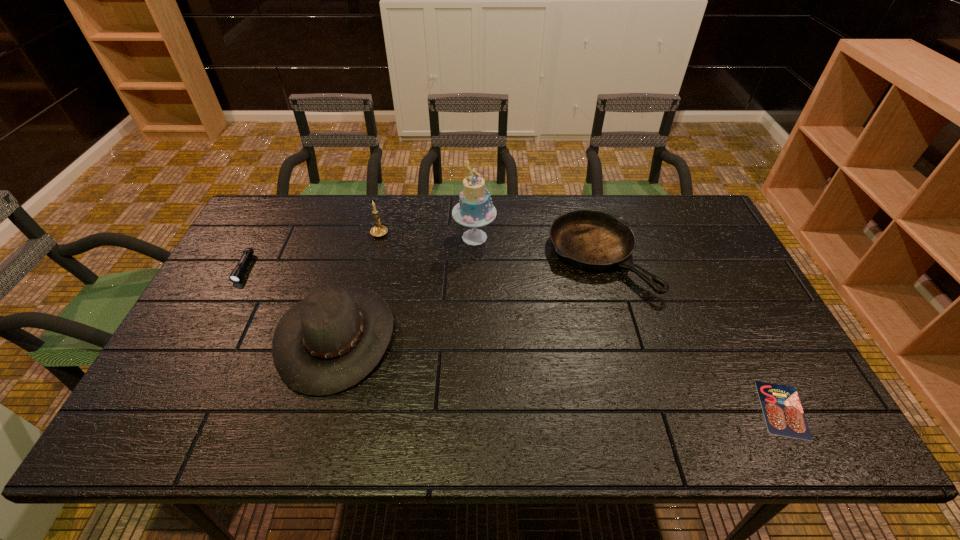
Locate an element on the screen. The image size is (960, 540). object that is at the left edge is located at coordinates (237, 273).

The height and width of the screenshot is (540, 960). In order to click on object that is at the right edge in this screenshot , I will do `click(784, 416)`.

Find the location of a particular element. The width and height of the screenshot is (960, 540). object at the near right corner is located at coordinates (784, 416).

The width and height of the screenshot is (960, 540). Identify the location of free space at the far edge. (322, 213).

This screenshot has height=540, width=960. Find the location of `vacant region at the near edge of the desktop`. vacant region at the near edge of the desktop is located at coordinates (479, 440).

Where is `blank space at the right edge`? This screenshot has height=540, width=960. blank space at the right edge is located at coordinates (799, 387).

Where is `vacant space at the far left corner of the desktop`? vacant space at the far left corner of the desktop is located at coordinates click(x=302, y=197).

Where is `vacant area at the far right corner`? vacant area at the far right corner is located at coordinates (674, 195).

Where is `free area in between the rightmost object and the cake`? The image size is (960, 540). free area in between the rightmost object and the cake is located at coordinates (629, 323).

Locate an element on the screen. This screenshot has height=540, width=960. empty space between the leftmost object and the second object from right to left is located at coordinates (421, 263).